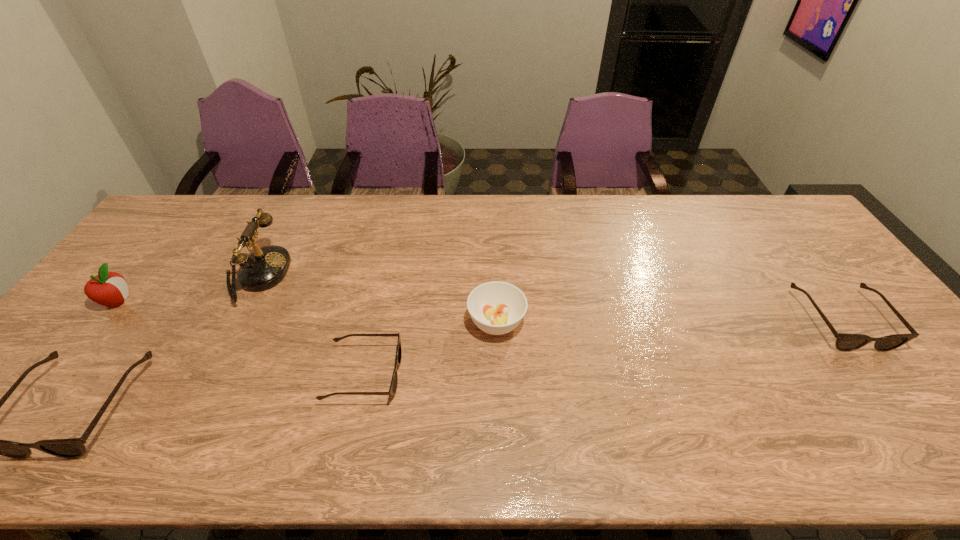
Locate an element on the screen. object that is the third closest to the leftmost sunglasses is located at coordinates (393, 386).

Select which object appears as the second closest to the telephone. Please provide its 2D coordinates. Your answer should be formatted as a tuple, i.e. [(x, y)], where the tuple contains the x and y coordinates of a point satisfying the conditions above.

[(107, 288)]

Locate an element on the screen. the closest sunglasses relative to the fifth shortest object is located at coordinates (72, 448).

Where is `sunglasses that stands as the closest to the third object from left to right`? This screenshot has height=540, width=960. sunglasses that stands as the closest to the third object from left to right is located at coordinates (72, 448).

Where is `blank space that satisfies the following two spatial constraints: 1. on the dial of the tallest object; 2. on the front side of the apple`? blank space that satisfies the following two spatial constraints: 1. on the dial of the tallest object; 2. on the front side of the apple is located at coordinates (244, 301).

The image size is (960, 540). In order to click on vacant space that satisfies the following two spatial constraints: 1. on the back side of the second object from right to left; 2. on the dial of the fourth object from right to left in this screenshot , I will do `click(494, 275)`.

At what (x,y) coordinates should I click in order to perform the action: click on vacant point that satisfies the following two spatial constraints: 1. on the front lenses of the second tallest sunglasses; 2. on the front lenses of the fourth object from left to right. Please return your answer as a coordinate pair (x, y). Looking at the image, I should click on (880, 374).

What are the coordinates of `free space that satisfies the following two spatial constraints: 1. on the dial of the fourth object from right to left; 2. on the back side of the soup bowl` in the screenshot? It's located at (233, 322).